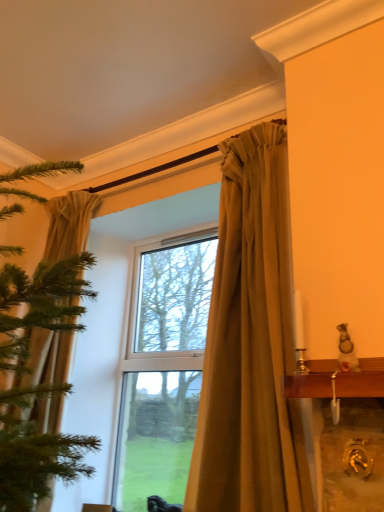
Question: In which direction should I rotate to look at matte gold curtain at center, the second curtain from the left?

Choices:
 (A) right
 (B) left

Answer: (A)

Question: Does matte gold curtain at center, the second curtain from the left, have a larger size compared to silky beige curtain at left, which appears as the first curtain when viewed from the left?

Choices:
 (A) yes
 (B) no

Answer: (B)

Question: From the image's perspective, would you say matte gold curtain at center, the second curtain from the left, is shown under silky beige curtain at left, which appears as the first curtain when viewed from the left?

Choices:
 (A) yes
 (B) no

Answer: (B)

Question: Is matte gold curtain at center, the second curtain from the left, smaller than silky beige curtain at left, which appears as the first curtain when viewed from the left?

Choices:
 (A) no
 (B) yes

Answer: (B)

Question: Does matte gold curtain at center, the second curtain from the left, have a lesser height compared to silky beige curtain at left, marked as the 2th curtain in a right-to-left arrangement?

Choices:
 (A) yes
 (B) no

Answer: (A)

Question: Is matte gold curtain at center, the second curtain from the left, far from silky beige curtain at left, which appears as the first curtain when viewed from the left?

Choices:
 (A) yes
 (B) no

Answer: (A)

Question: Considering the relative sizes of matte gold curtain at center, which appears as the first curtain when viewed from the right, and silky beige curtain at left, which appears as the first curtain when viewed from the left, in the image provided, is matte gold curtain at center, which appears as the first curtain when viewed from the right, wider than silky beige curtain at left, which appears as the first curtain when viewed from the left,?

Choices:
 (A) yes
 (B) no

Answer: (B)

Question: Is matte gold curtain at center, the second curtain from the left, at the back of silky beige curtain at left, which appears as the first curtain when viewed from the left?

Choices:
 (A) no
 (B) yes

Answer: (A)

Question: From the image's perspective, is silky beige curtain at left, marked as the 2th curtain in a right-to-left arrangement, located above matte gold curtain at center, which appears as the first curtain when viewed from the right?

Choices:
 (A) no
 (B) yes

Answer: (A)

Question: Is the depth of silky beige curtain at left, marked as the 2th curtain in a right-to-left arrangement, greater than that of matte gold curtain at center, the second curtain from the left?

Choices:
 (A) yes
 (B) no

Answer: (A)

Question: Considering the relative sizes of silky beige curtain at left, marked as the 2th curtain in a right-to-left arrangement, and matte gold curtain at center, which appears as the first curtain when viewed from the right, in the image provided, is silky beige curtain at left, marked as the 2th curtain in a right-to-left arrangement, wider than matte gold curtain at center, which appears as the first curtain when viewed from the right,?

Choices:
 (A) no
 (B) yes

Answer: (B)

Question: Considering the relative positions of silky beige curtain at left, marked as the 2th curtain in a right-to-left arrangement, and matte gold curtain at center, the second curtain from the left, in the image provided, is silky beige curtain at left, marked as the 2th curtain in a right-to-left arrangement, to the right of matte gold curtain at center, the second curtain from the left, from the viewer's perspective?

Choices:
 (A) no
 (B) yes

Answer: (A)

Question: Does silky beige curtain at left, marked as the 2th curtain in a right-to-left arrangement, have a larger size compared to matte gold curtain at center, which appears as the first curtain when viewed from the right?

Choices:
 (A) yes
 (B) no

Answer: (A)

Question: Is point (253, 364) closer or farther from the camera than point (51, 356)?

Choices:
 (A) farther
 (B) closer

Answer: (B)